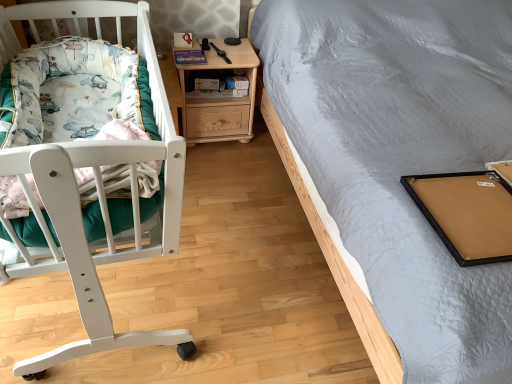
Question: Is fluffy cotton blanket at left to the left of light woodmaterial/texturenightstand at center from the viewer's perspective?

Choices:
 (A) yes
 (B) no

Answer: (A)

Question: Is fluffy cotton blanket at left at the right side of light woodmaterial/texturenightstand at center?

Choices:
 (A) no
 (B) yes

Answer: (A)

Question: Considering the relative sizes of fluffy cotton blanket at left and light woodmaterial/texturenightstand at center in the image provided, is fluffy cotton blanket at left smaller than light woodmaterial/texturenightstand at center?

Choices:
 (A) no
 (B) yes

Answer: (B)

Question: Does fluffy cotton blanket at left come behind light woodmaterial/texturenightstand at center?

Choices:
 (A) no
 (B) yes

Answer: (A)

Question: Would you consider fluffy cotton blanket at left to be distant from light woodmaterial/texturenightstand at center?

Choices:
 (A) yes
 (B) no

Answer: (A)

Question: Could light woodmaterial/texturenightstand at center be considered to be inside fluffy cotton blanket at left?

Choices:
 (A) yes
 (B) no

Answer: (B)

Question: Is light woodmaterial/texturenightstand at center wider than fluffy cotton blanket at left?

Choices:
 (A) no
 (B) yes

Answer: (A)

Question: From a real-world perspective, is light woodmaterial/texturenightstand at center physically below fluffy cotton blanket at left?

Choices:
 (A) no
 (B) yes

Answer: (B)

Question: Is light woodmaterial/texturenightstand at center outside of fluffy cotton blanket at left?

Choices:
 (A) no
 (B) yes

Answer: (B)

Question: Does light woodmaterial/texturenightstand at center touch fluffy cotton blanket at left?

Choices:
 (A) no
 (B) yes

Answer: (A)

Question: Is light woodmaterial/texturenightstand at center positioned with its back to fluffy cotton blanket at left?

Choices:
 (A) yes
 (B) no

Answer: (B)

Question: Is light woodmaterial/texturenightstand at center not close to fluffy cotton blanket at left?

Choices:
 (A) no
 (B) yes

Answer: (B)

Question: Considering the positions of fluffy cotton blanket at left and light woodmaterial/texturenightstand at center in the image, is fluffy cotton blanket at left taller or shorter than light woodmaterial/texturenightstand at center?

Choices:
 (A) short
 (B) tall

Answer: (A)